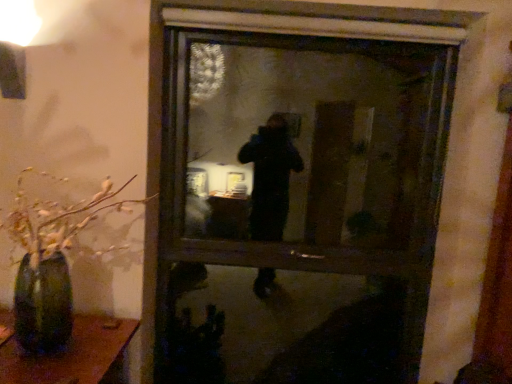
Where is `transparent glass window at center`? This screenshot has width=512, height=384. transparent glass window at center is located at coordinates (445, 167).

What do you see at coordinates (445, 167) in the screenshot? The width and height of the screenshot is (512, 384). I see `transparent glass window at center` at bounding box center [445, 167].

Locate an element on the screen. The width and height of the screenshot is (512, 384). green matte vase at left is located at coordinates (50, 262).

Measure the distance between green matte vase at left and camera.

They are 1.29 meters apart.

Describe the element at coordinates (50, 262) in the screenshot. I see `green matte vase at left` at that location.

Locate an element on the screen. The width and height of the screenshot is (512, 384). transparent glass window at center is located at coordinates pyautogui.click(x=445, y=167).

Based on their positions, is transparent glass window at center located to the left or right of green matte vase at left?

Based on their positions, transparent glass window at center is located to the right of green matte vase at left.

Which object is more forward, transparent glass window at center or green matte vase at left?

green matte vase at left is closer to the camera.

Is point (465, 301) closer or farther from the camera than point (102, 251)?

Point (465, 301) is positioned farther from the camera compared to point (102, 251).

From the image's perspective, which object appears higher, transparent glass window at center or green matte vase at left?

transparent glass window at center.

From the picture: From a real-world perspective, which is physically above, transparent glass window at center or green matte vase at left?

In real-world perspective, green matte vase at left is above.

Is transparent glass window at center wider or thinner than green matte vase at left?

Clearly, transparent glass window at center has less width compared to green matte vase at left.

Does transparent glass window at center have a lesser height compared to green matte vase at left?

No, transparent glass window at center is not shorter than green matte vase at left.

In terms of size, does transparent glass window at center appear bigger or smaller than green matte vase at left?

In the image, transparent glass window at center appears to be larger than green matte vase at left.

Is transparent glass window at center inside or outside of green matte vase at left?

transparent glass window at center is outside green matte vase at left.

Are transparent glass window at center and green matte vase at left located far from each other?

transparent glass window at center is near green matte vase at left, not far away.

Could you tell me if transparent glass window at center is facing green matte vase at left?

No, transparent glass window at center is not oriented towards green matte vase at left.

How much distance is there between transparent glass window at center and green matte vase at left?

The distance of transparent glass window at center from green matte vase at left is 20.50 inches.

This screenshot has width=512, height=384. Find the location of `houseplant lying in front of the transparent glass window at center`. houseplant lying in front of the transparent glass window at center is located at coordinates (50, 262).

Is green matte vase at left to the left or to the right of transparent glass window at center in the image?

green matte vase at left is to the left of transparent glass window at center.

Between green matte vase at left and transparent glass window at center, which one is positioned behind?

transparent glass window at center is more distant.

Is point (17, 227) closer or farther from the camera than point (296, 11)?

Point (17, 227) appears to be closer to the viewer than point (296, 11).

From the image's perspective, is green matte vase at left positioned above or below transparent glass window at center?

Based on their image positions, green matte vase at left is located beneath transparent glass window at center.

Looking at this image, from a real-world perspective, is green matte vase at left located higher than transparent glass window at center?

Yes, from a real-world perspective, green matte vase at left is on top of transparent glass window at center.

Consider the image. Does green matte vase at left have a greater width compared to transparent glass window at center?

Yes.

Is green matte vase at left shorter than transparent glass window at center?

Yes, green matte vase at left is shorter than transparent glass window at center.

Considering the sizes of objects green matte vase at left and transparent glass window at center in the image provided, who is smaller, green matte vase at left or transparent glass window at center?

With smaller size is green matte vase at left.

Can transparent glass window at center be found inside green matte vase at left?

No, transparent glass window at center is not inside green matte vase at left.

Is green matte vase at left directly adjacent to transparent glass window at center?

No, green matte vase at left is not with transparent glass window at center.

Does green matte vase at left turn towards transparent glass window at center?

No, green matte vase at left is not aimed at transparent glass window at center.

What's the angular difference between green matte vase at left and transparent glass window at center's facing directions?

There is a 0.917-degree angle between the facing directions of green matte vase at left and transparent glass window at center.

Find the location of a particular element. The height and width of the screenshot is (384, 512). window on the right of green matte vase at left is located at coordinates (445, 167).

I want to click on houseplant above the transparent glass window at center (from a real-world perspective), so click(50, 262).

Find the location of `window behind the green matte vase at left`. window behind the green matte vase at left is located at coordinates (445, 167).